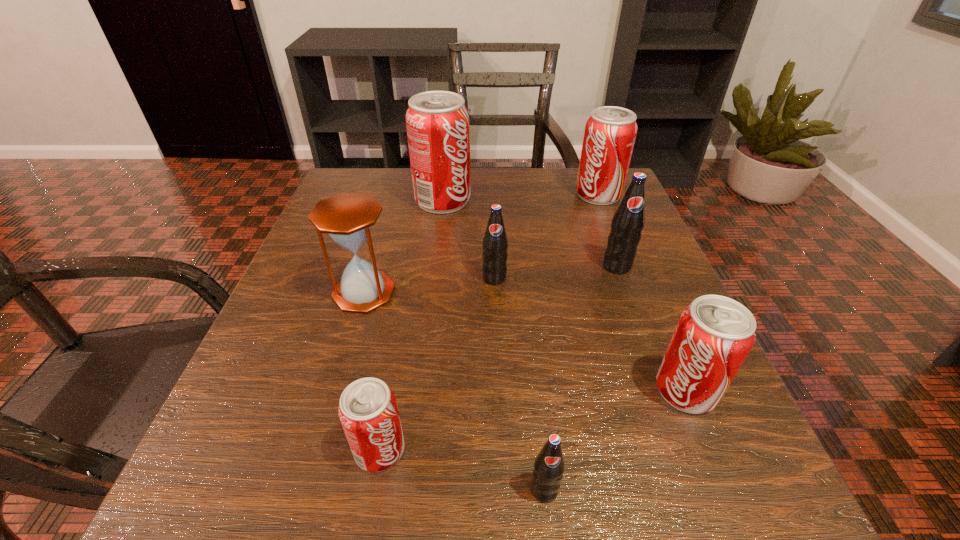
Where is `vacant area that lies between the rightmost black pop and the biggest red soda can`? The width and height of the screenshot is (960, 540). vacant area that lies between the rightmost black pop and the biggest red soda can is located at coordinates pos(530,233).

Where is `free space between the third pop from left to right and the third nearest object`? free space between the third pop from left to right and the third nearest object is located at coordinates (590, 334).

Locate an element on the screen. The image size is (960, 540). vacant point located between the biggest black pop and the smallest black pop is located at coordinates (581, 378).

Locate an element on the screen. Image resolution: width=960 pixels, height=540 pixels. empty space that is in between the rightmost black pop and the third pop from left to right is located at coordinates (556, 272).

The height and width of the screenshot is (540, 960). What are the coordinates of `vacant region between the leftmost black pop and the rightmost black pop` in the screenshot? It's located at (556, 272).

Locate an element on the screen. The width and height of the screenshot is (960, 540). free space between the sixth farthest object and the nearest object is located at coordinates (615, 440).

This screenshot has height=540, width=960. What are the coordinates of `object that stands as the closest to the hourglass` in the screenshot? It's located at click(495, 243).

The image size is (960, 540). Identify the location of object that ranks as the seventh closest to the second biggest black pop. (549, 466).

Point out which pop is positioned as the sixth nearest to the third smallest red soda can. Please provide its 2D coordinates. Your answer should be formatted as a tuple, i.e. [(x, y)], where the tuple contains the x and y coordinates of a point satisfying the conditions above.

[(368, 411)]

Locate an element on the screen. pop that is the closest to the second biggest red soda can is located at coordinates (628, 221).